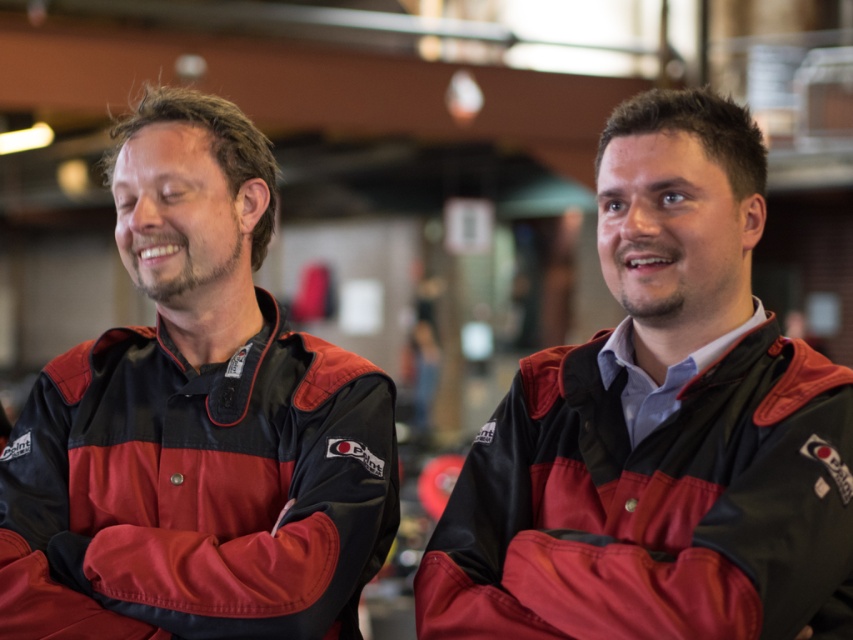
You are organizing a clothing display and need to place the matte black jacket at center and the matte nylon jacket at center side by side. Given that the display rack has a fixed width of 1 meter, can both jackets fit without overlapping if placed next to each other?

The matte black jacket at center is wider than the matte nylon jacket at center. However, since the total width of both jackets combined is not provided, it is impossible to determine if they can fit on a 1 meter rack without overlapping. Additional information about their individual widths is required to make this assessment.

Looking at this image, you are a photographer who needs to place a small prop at point (659, 428). According to the scene, what object is located at that coordinate?

The object at point (659, 428) is the matte black jacket at center.

You are a photographer setting up a photoshoot for two jackets. The scene requires the taller jacket to be placed in the center to draw attention. Given the current arrangement of the matte black jacket at left and the matte nylon jacket at center, can you determine which jacket needs to be moved to the center?

The matte black jacket at left is much taller than the matte nylon jacket at center, so the matte black jacket at left should be moved to the center to highlight its height.